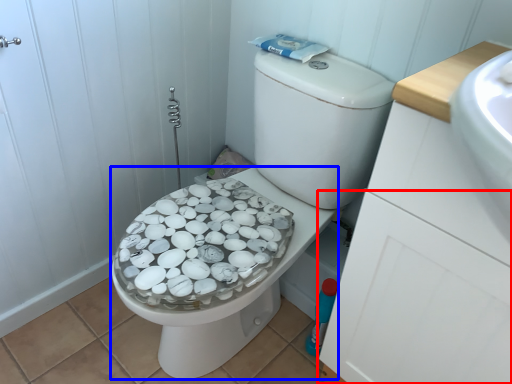
Question: Among these objects, which one is nearest to the camera, drawer (highlighted by a red box) or bidet (highlighted by a blue box)?

Choices:
 (A) drawer
 (B) bidet

Answer: (A)